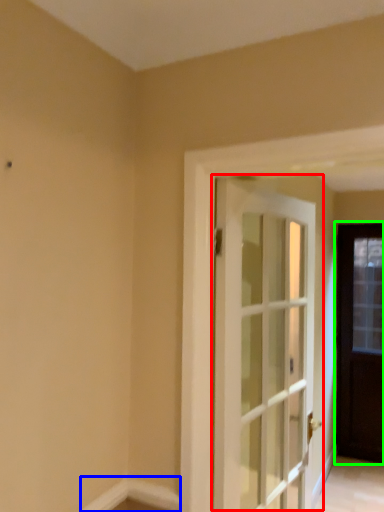
Question: Estimate the real-world distances between objects in this image. Which object is closer to door (highlighted by a red box), molding (highlighted by a blue box) or door (highlighted by a green box)?

Choices:
 (A) molding
 (B) door

Answer: (A)